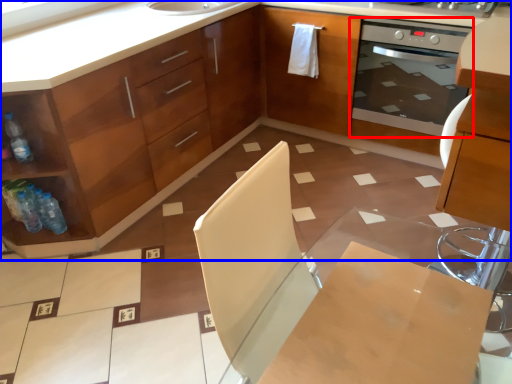
Question: Which object appears farthest to the camera in this image, home appliance (highlighted by a red box) or cabinetry (highlighted by a blue box)?

Choices:
 (A) home appliance
 (B) cabinetry

Answer: (A)